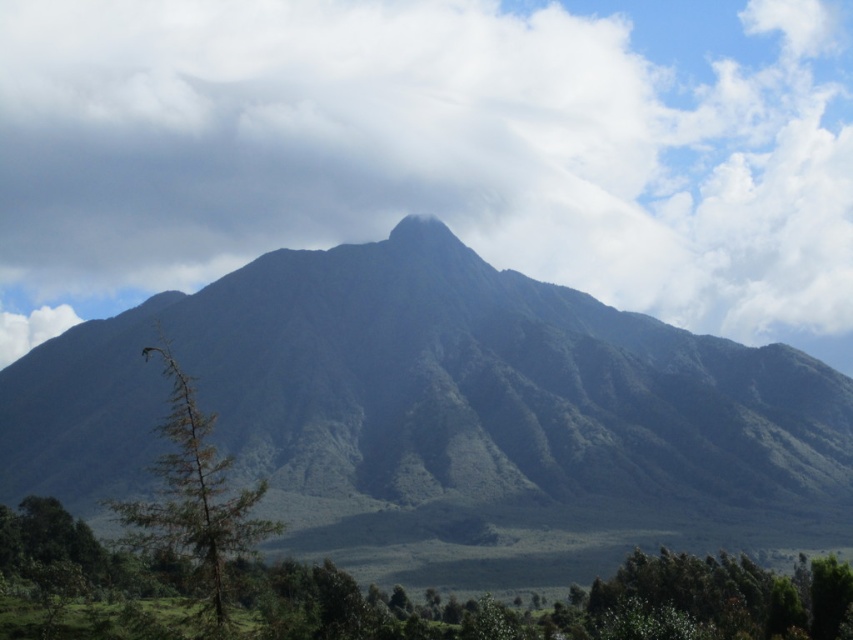
Question: Which object is the closest to the green matte tree at left?

Choices:
 (A) white fluffy cloud at upper center
 (B) green matte mountain peak at center

Answer: (B)

Question: Can you confirm if white fluffy cloud at upper center is thinner than green grassy mountain at center?

Choices:
 (A) yes
 (B) no

Answer: (B)

Question: Which point is closer to the camera?

Choices:
 (A) green matte mountain peak at center
 (B) green grassy mountain at center

Answer: (B)

Question: Estimate the real-world distances between objects in this image. Which object is closer to the green matte mountain peak at center?

Choices:
 (A) green grassy mountain at center
 (B) green matte tree at left

Answer: (A)

Question: Is white fluffy cloud at upper center positioned in front of green grassy mountain at center?

Choices:
 (A) no
 (B) yes

Answer: (A)

Question: Is white fluffy cloud at upper center smaller than green matte tree at left?

Choices:
 (A) yes
 (B) no

Answer: (B)